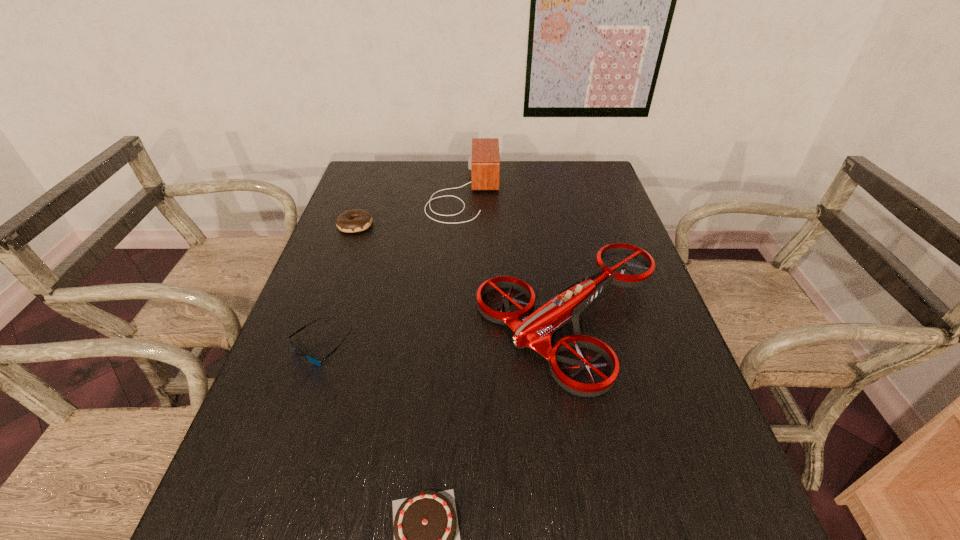
Image resolution: width=960 pixels, height=540 pixels. What are the coordinates of `sunglasses situated at the left edge` in the screenshot? It's located at (315, 361).

Find the location of a particular element. object located at the right edge is located at coordinates (534, 330).

In order to click on free space at the far edge in this screenshot , I will do `click(473, 192)`.

Identify the location of vacant space at the left edge. (353, 204).

Identify the location of blank space at the right edge. The height and width of the screenshot is (540, 960). (636, 379).

Find the location of a particular element. vacant space at the far left corner is located at coordinates (348, 194).

Find the location of a particular element. The width and height of the screenshot is (960, 540). blank space at the far right corner of the desktop is located at coordinates (588, 185).

The image size is (960, 540). Identify the location of vacant area between the second tallest object and the doughnut. (463, 273).

Find the location of a particular element. free space between the drone and the tallest object is located at coordinates (516, 257).

At what (x,y) coordinates should I click in order to perform the action: click on unoccupied position between the drone and the doughnut. Please return your answer as a coordinate pair (x, y). The height and width of the screenshot is (540, 960). Looking at the image, I should click on (463, 273).